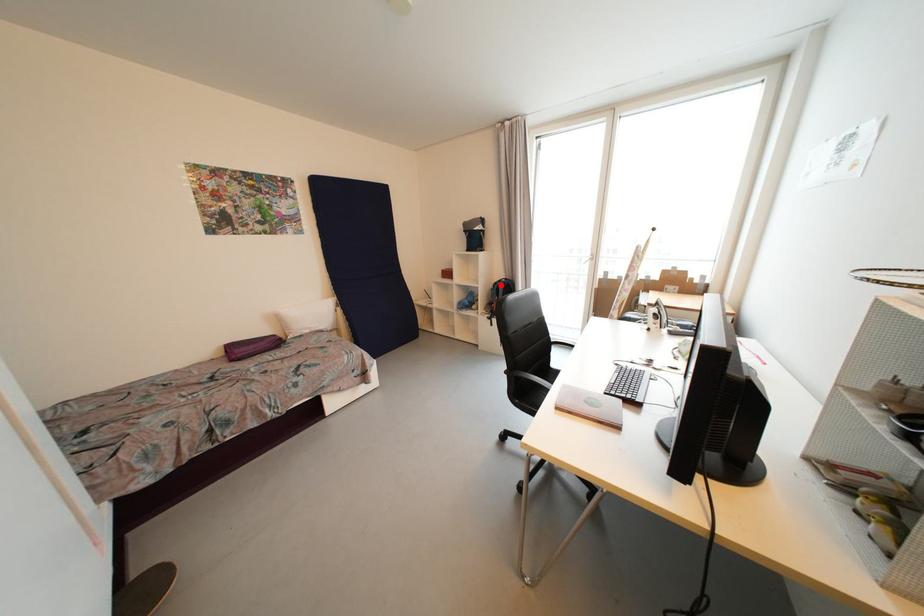
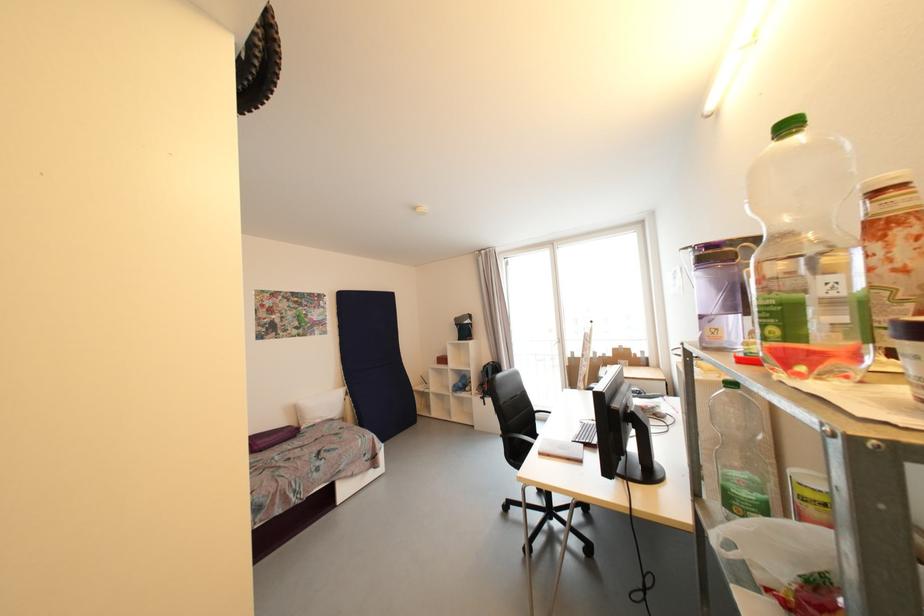
Question: I am providing you with two images of the same scene from different viewpoints. In image1, a red point is highlighted. Considering the same 3D point in image2, which of the following is correct?

Choices:
 (A) It is closer
 (B) It is farther

Answer: (B)